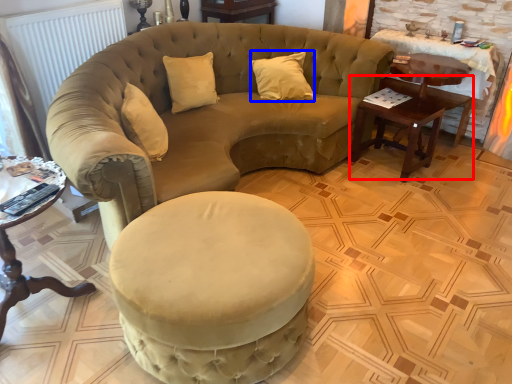
Question: Which of the following is the closest to the observer, table (highlighted by a red box) or pillow (highlighted by a blue box)?

Choices:
 (A) table
 (B) pillow

Answer: (A)